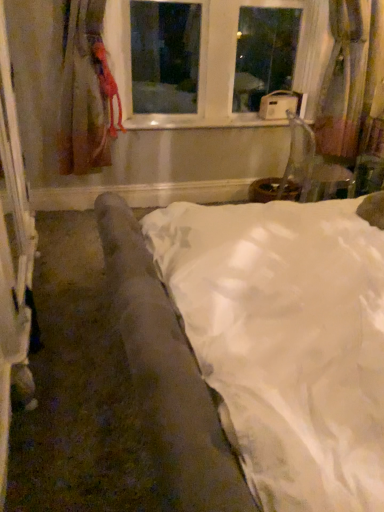
Question: Does matte red curtain at left, acting as the 1th curtain starting from the left, appear on the right side of white glossy window sill at center?

Choices:
 (A) no
 (B) yes

Answer: (A)

Question: Does matte red curtain at left, the 2th curtain from the right, have a lesser height compared to white glossy window sill at center?

Choices:
 (A) no
 (B) yes

Answer: (A)

Question: From the image's perspective, is matte red curtain at left, acting as the 1th curtain starting from the left, located beneath white glossy window sill at center?

Choices:
 (A) no
 (B) yes

Answer: (A)

Question: Does matte red curtain at left, the 2th curtain from the right, lie behind white glossy window sill at center?

Choices:
 (A) yes
 (B) no

Answer: (B)

Question: Does matte red curtain at left, acting as the 1th curtain starting from the left, have a greater height compared to white glossy window sill at center?

Choices:
 (A) no
 (B) yes

Answer: (B)

Question: Is white glossy window sill at center inside the boundaries of white plastic window at upper center, or outside?

Choices:
 (A) inside
 (B) outside

Answer: (B)

Question: Would you say white glossy window sill at center is to the left or to the right of white plastic window at upper center in the picture?

Choices:
 (A) right
 (B) left

Answer: (B)

Question: Looking at the image, does white glossy window sill at center seem bigger or smaller compared to white plastic window at upper center?

Choices:
 (A) big
 (B) small

Answer: (B)

Question: Considering the positions of white glossy window sill at center and white plastic window at upper center in the image, is white glossy window sill at center wider or thinner than white plastic window at upper center?

Choices:
 (A) wide
 (B) thin

Answer: (B)

Question: Does point (110, 13) appear closer or farther from the camera than point (334, 4)?

Choices:
 (A) closer
 (B) farther

Answer: (A)

Question: From a real-world perspective, relative to velvet-like pink curtain at right, which ranks as the second curtain in left-to-right order, is white plastic window at upper center vertically above or below?

Choices:
 (A) below
 (B) above

Answer: (B)

Question: From the image's perspective, relative to velvet-like pink curtain at right, positioned as the 1th curtain in right-to-left order, is white plastic window at upper center above or below?

Choices:
 (A) above
 (B) below

Answer: (A)

Question: In the image, is white plastic window at upper center positioned in front of or behind velvet-like pink curtain at right, positioned as the 1th curtain in right-to-left order?

Choices:
 (A) behind
 (B) front

Answer: (B)

Question: In terms of height, does velvet brown armchair at lower right look taller or shorter compared to white satin bed at center?

Choices:
 (A) tall
 (B) short

Answer: (A)

Question: Does point (291, 142) appear closer or farther from the camera than point (115, 217)?

Choices:
 (A) closer
 (B) farther

Answer: (B)